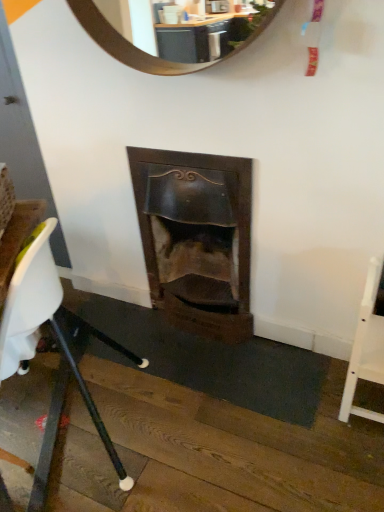
This screenshot has height=512, width=384. What are the coordinates of `vacant area that lies between white plastic chair at lower left, acting as the first chair starting from the left, and wooden fireplace at center` in the screenshot? It's located at (156, 361).